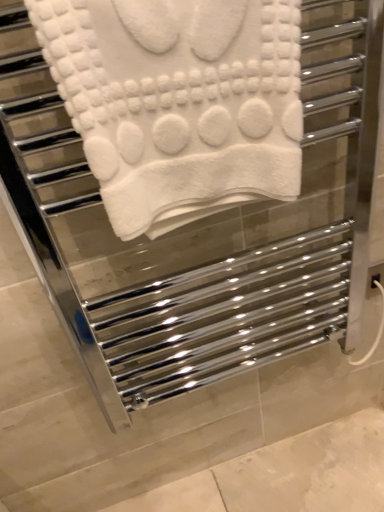
Image resolution: width=384 pixels, height=512 pixels. I want to click on white fluffy towel at upper center, so click(179, 102).

The image size is (384, 512). What do you see at coordinates (179, 102) in the screenshot?
I see `white fluffy towel at upper center` at bounding box center [179, 102].

The height and width of the screenshot is (512, 384). What are the coordinates of `white fluffy towel at upper center` in the screenshot? It's located at (179, 102).